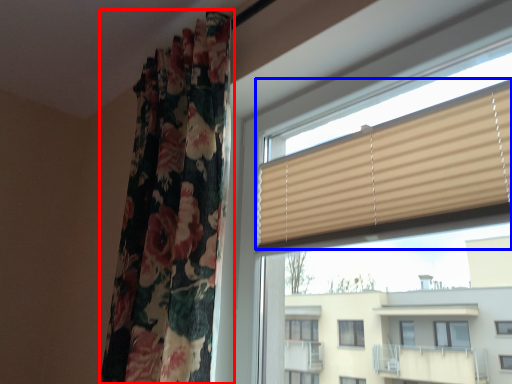
Question: Which object appears closest to the camera in this image, curtain (highlighted by a red box) or window blind (highlighted by a blue box)?

Choices:
 (A) curtain
 (B) window blind

Answer: (B)